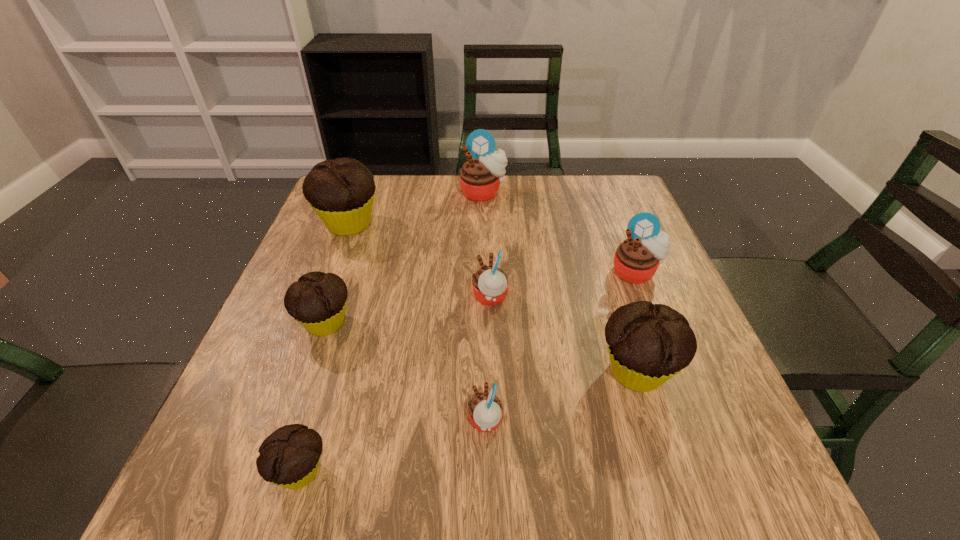
Identify the location of the farthest object. The height and width of the screenshot is (540, 960). (480, 177).

Identify the location of the farthest muffin. Image resolution: width=960 pixels, height=540 pixels. (480, 177).

Locate an element on the screen. The width and height of the screenshot is (960, 540). the second farthest object is located at coordinates (341, 191).

In order to click on the seventh nearest muffin in this screenshot , I will do `click(341, 191)`.

At what (x,y) coordinates should I click in order to perform the action: click on the rightmost pink muffin. Please return your answer as a coordinate pair (x, y). Looking at the image, I should click on (636, 260).

Find the location of a particular element. The width and height of the screenshot is (960, 540). the rightmost chocolate muffin is located at coordinates (648, 344).

Find the location of a particular element. The width and height of the screenshot is (960, 540). the third biggest pink muffin is located at coordinates (490, 284).

Identify the location of the third biggest chocolate muffin. This screenshot has width=960, height=540. (317, 301).

Find the location of a particular element. the nearest pink muffin is located at coordinates [485, 410].

You are a GUI agent. You are given a task and a screenshot of the screen. Output one action in this format:
    pyautogui.click(x=<x>, y=<y>)
    Task: Click on the nearest object
    The width and height of the screenshot is (960, 540).
    Given the screenshot: What is the action you would take?
    pyautogui.click(x=289, y=457)